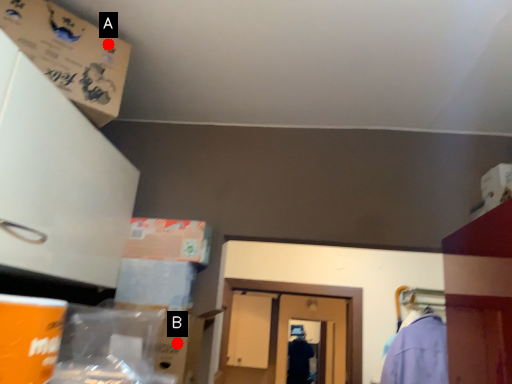
Question: Two points are circled on the image, labeled by A and B beside each circle. Which point is closer to the camera taking this photo?

Choices:
 (A) A is closer
 (B) B is closer

Answer: (A)